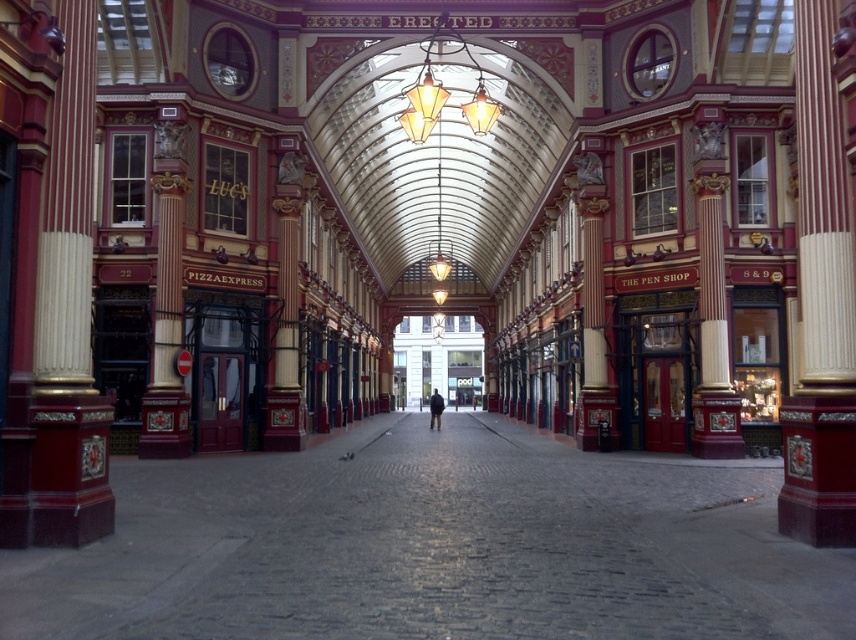
Is matte gold column at left closer to camera compared to polished red pillar at right?

Yes, matte gold column at left is in front of polished red pillar at right.

Is point (76, 84) more distant than point (803, 92)?

No.

The width and height of the screenshot is (856, 640). In order to click on matte gold column at left in this screenshot , I will do `click(68, 314)`.

Between polished red pillar at right and dark blue jacket at center, which one appears on the left side from the viewer's perspective?

dark blue jacket at center is more to the left.

Does polished red pillar at right have a smaller size compared to dark blue jacket at center?

Indeed, polished red pillar at right has a smaller size compared to dark blue jacket at center.

Which is behind, point (846, 352) or point (432, 426)?

Point (432, 426)

At what (x,y) coordinates should I click in order to perform the action: click on polished red pillar at right. Please return your answer as a coordinate pair (x, y). Image resolution: width=856 pixels, height=640 pixels. Looking at the image, I should click on (819, 305).

Does point (85, 64) come closer to viewer compared to point (431, 404)?

Yes.

Does matte gold column at left lie in front of dark blue jacket at center?

That is True.

Find the location of a particular element. Image resolution: width=856 pixels, height=640 pixels. matte gold column at left is located at coordinates (68, 314).